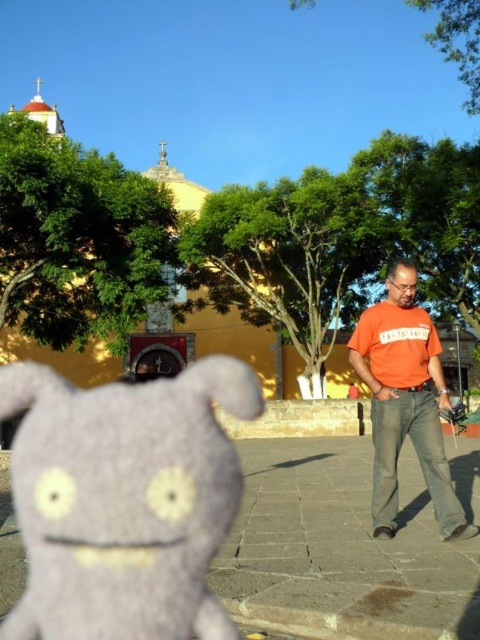
Who is positioned more to the left, gray felt plush at center or orange cotton t-shirt at right?

From the viewer's perspective, gray felt plush at center appears more on the left side.

Who is positioned more to the right, gray felt plush at center or orange cotton t-shirt at right?

orange cotton t-shirt at right is more to the right.

Which is behind, point (134, 422) or point (447, 525)?

The point (134, 422) is behind.

Identify the location of gray felt plush at center. (123, 500).

The height and width of the screenshot is (640, 480). Describe the element at coordinates (340, 548) in the screenshot. I see `gray stone pavement at center` at that location.

Can you confirm if gray stone pavement at center is smaller than orange cotton t-shirt at right?

Incorrect, gray stone pavement at center is not smaller in size than orange cotton t-shirt at right.

Which is behind, point (474, 512) or point (381, 486)?

Positioned behind is point (474, 512).

The image size is (480, 640). I want to click on gray stone pavement at center, so click(x=340, y=548).

Can you confirm if gray felt plush at center is smaller than gray stone pavement at center?

No.

Between gray felt plush at center and gray stone pavement at center, which one appears on the left side from the viewer's perspective?

Positioned to the left is gray felt plush at center.

Between point (239, 486) and point (312, 593), which one is positioned behind?

The point (239, 486) is behind.

You are a GUI agent. You are given a task and a screenshot of the screen. Output one action in this format:
    pyautogui.click(x=<x>, y=<y>)
    Task: Click on the gray felt plush at center
    The image size is (480, 640).
    Given the screenshot: What is the action you would take?
    pyautogui.click(x=123, y=500)